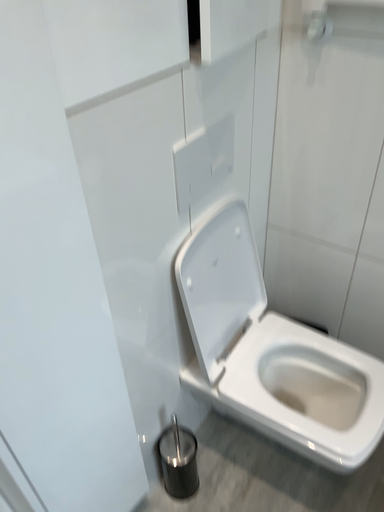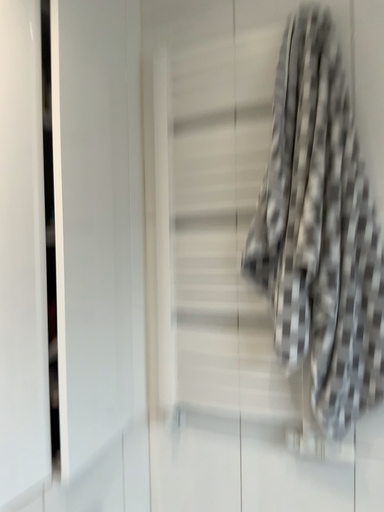
Question: How did the camera likely rotate when shooting the video?

Choices:
 (A) rotated right
 (B) rotated left

Answer: (A)